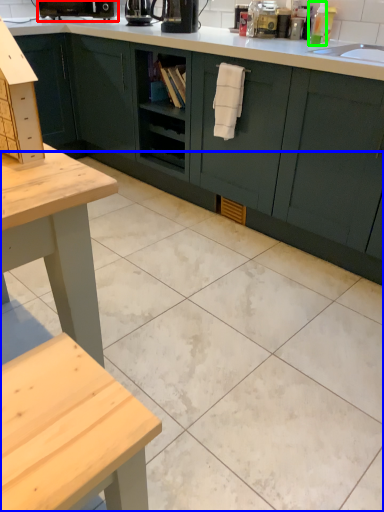
Question: Which is farther away from coffee machine (highlighted by a red box)? ceramic tile (highlighted by a blue box) or toiletry (highlighted by a green box)?

Choices:
 (A) ceramic tile
 (B) toiletry

Answer: (A)